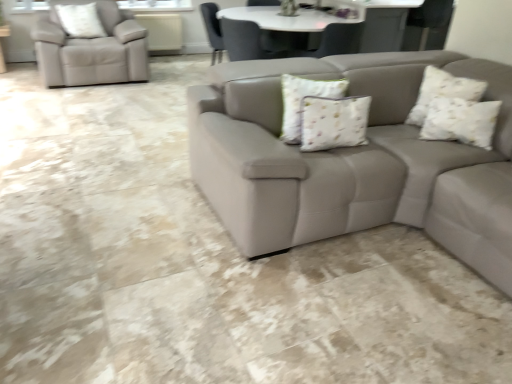
Question: Is white textured pillow at upper left, marked as the first pillow in a left-to-right arrangement, shorter than white textured pillow at upper right, acting as the 2th pillow starting from the front?

Choices:
 (A) no
 (B) yes

Answer: (A)

Question: Is white textured pillow at upper left, placed as the 3th pillow when sorted from right to left, wider than white textured pillow at upper right, which appears as the second pillow when viewed from the top?

Choices:
 (A) yes
 (B) no

Answer: (B)

Question: Is white textured pillow at upper right, the second pillow when ordered from bottom to top, located within white textured pillow at upper left, the 1th pillow from the back?

Choices:
 (A) yes
 (B) no

Answer: (B)

Question: Considering the relative sizes of white textured pillow at upper left, placed as the 3th pillow when sorted from right to left, and white textured pillow at upper right, positioned as the 2th pillow in back-to-front order, in the image provided, is white textured pillow at upper left, placed as the 3th pillow when sorted from right to left, thinner than white textured pillow at upper right, positioned as the 2th pillow in back-to-front order,?

Choices:
 (A) yes
 (B) no

Answer: (A)

Question: Does white textured pillow at upper left, the 1th pillow from the back, have a greater height compared to white textured pillow at upper right, which appears as the second pillow when viewed from the top?

Choices:
 (A) yes
 (B) no

Answer: (A)

Question: Based on their sizes in the image, would you say white textured pillow at upper left, the 1th pillow from the back, is bigger or smaller than white floral fabric pillow at center, which is counted as the first pillow, starting from the bottom?

Choices:
 (A) big
 (B) small

Answer: (A)

Question: Considering the positions of white textured pillow at upper left, which appears as the third pillow when viewed from the front, and white floral fabric pillow at center, the first pillow in the front-to-back sequence, in the image, is white textured pillow at upper left, which appears as the third pillow when viewed from the front, taller or shorter than white floral fabric pillow at center, the first pillow in the front-to-back sequence,?

Choices:
 (A) short
 (B) tall

Answer: (B)

Question: Is white textured pillow at upper left, the 1th pillow from the back, inside or outside of white floral fabric pillow at center, positioned as the second pillow in left-to-right order?

Choices:
 (A) inside
 (B) outside

Answer: (B)

Question: From a real-world perspective, relative to white floral fabric pillow at center, positioned as the second pillow in left-to-right order, is white textured pillow at upper left, marked as the first pillow in a left-to-right arrangement, vertically above or below?

Choices:
 (A) below
 (B) above

Answer: (B)

Question: Is white floral fabric pillow at center, arranged as the 2th pillow when viewed from the right, wider or thinner than white textured pillow at upper left, placed as the 3th pillow when sorted from right to left?

Choices:
 (A) wide
 (B) thin

Answer: (B)

Question: Considering their positions, is white floral fabric pillow at center, positioned as the 3th pillow in top-to-bottom order, located in front of or behind white textured pillow at upper left, marked as the first pillow in a left-to-right arrangement?

Choices:
 (A) behind
 (B) front

Answer: (B)

Question: Looking at the image, does white floral fabric pillow at center, positioned as the 3th pillow in top-to-bottom order, seem bigger or smaller compared to white textured pillow at upper left, which appears as the third pillow when viewed from the front?

Choices:
 (A) small
 (B) big

Answer: (A)

Question: From the image's perspective, is white floral fabric pillow at center, positioned as the 3th pillow in top-to-bottom order, above or below white textured pillow at upper left, the 1th pillow from the back?

Choices:
 (A) above
 (B) below

Answer: (B)

Question: In terms of width, does white textured pillow at upper right, positioned as the 2th pillow in back-to-front order, look wider or thinner when compared to white textured pillow at upper left, placed as the 3th pillow when sorted from right to left?

Choices:
 (A) thin
 (B) wide

Answer: (B)

Question: Based on their sizes in the image, would you say white textured pillow at upper right, which is the first pillow from right to left, is bigger or smaller than white textured pillow at upper left, which appears as the third pillow when viewed from the front?

Choices:
 (A) big
 (B) small

Answer: (B)